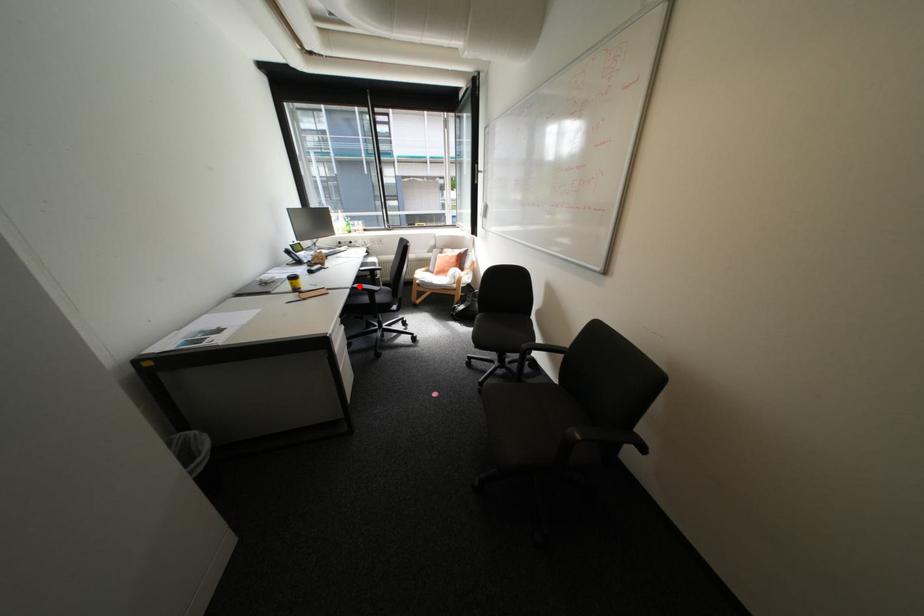
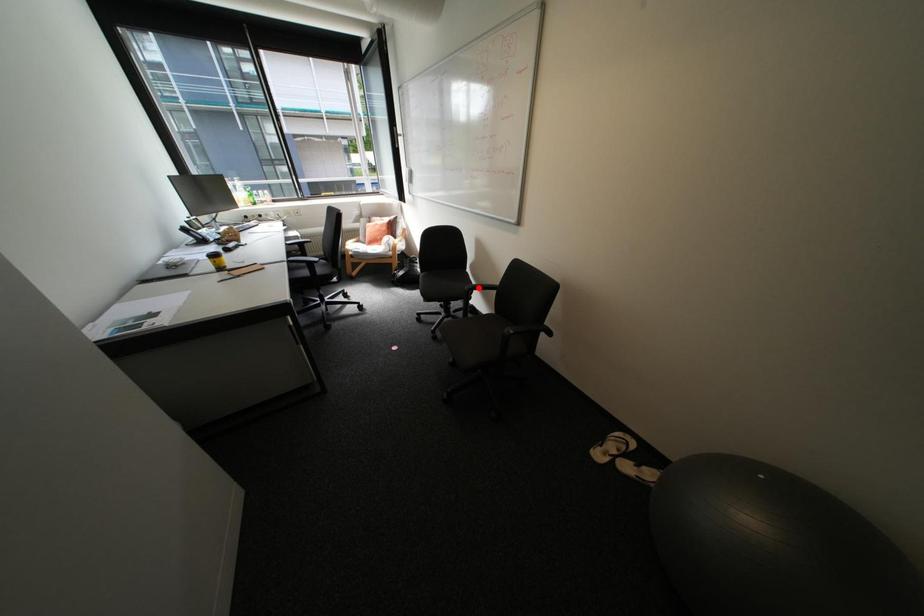
In the scene shown: I am providing you with two images of the same scene from different viewpoints. A red point is marked on the first image and another point is marked on the second image. Is the marked point in image1 the same physical position as the marked point in image2?

No